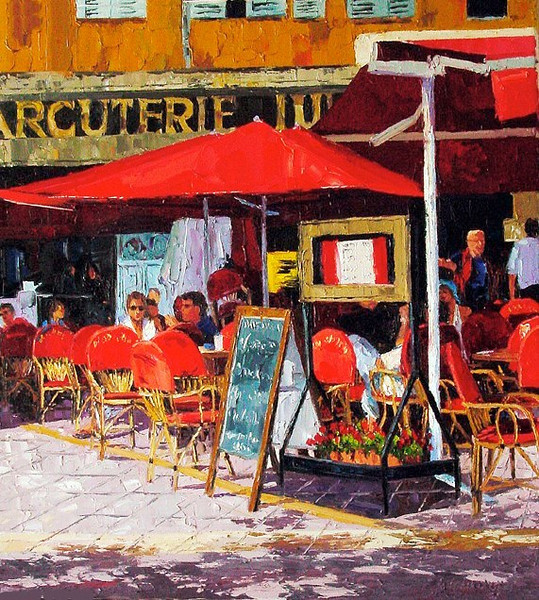
Locate an element on the screen. Image resolution: width=539 pixels, height=600 pixels. wall is located at coordinates (118, 42).